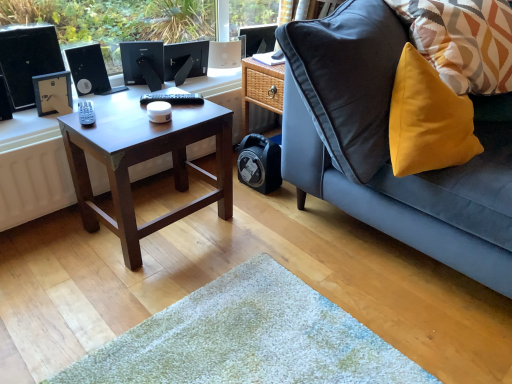
Question: Considering the relative positions of dark brown wood coffee table at center and satin black monitor at center, which is the 3th computer monitor in right-to-left order, in the image provided, is dark brown wood coffee table at center to the left of satin black monitor at center, which is the 3th computer monitor in right-to-left order, from the viewer's perspective?

Choices:
 (A) no
 (B) yes

Answer: (A)

Question: Is dark brown wood coffee table at center at the right side of satin black monitor at center, which is the 3th computer monitor in right-to-left order?

Choices:
 (A) yes
 (B) no

Answer: (A)

Question: Is dark brown wood coffee table at center taller than satin black monitor at center, the first computer monitor from the left?

Choices:
 (A) no
 (B) yes

Answer: (B)

Question: Can you confirm if dark brown wood coffee table at center is thinner than satin black monitor at center, the first computer monitor from the left?

Choices:
 (A) no
 (B) yes

Answer: (A)

Question: Does dark brown wood coffee table at center have a lesser height compared to satin black monitor at center, which is the 3th computer monitor in right-to-left order?

Choices:
 (A) yes
 (B) no

Answer: (B)

Question: Does point (320, 158) appear closer or farther from the camera than point (134, 82)?

Choices:
 (A) farther
 (B) closer

Answer: (B)

Question: From a real-world perspective, is mustard yellow fabric pillow at right above or below satin black monitor at center, the first computer monitor from the left?

Choices:
 (A) below
 (B) above

Answer: (B)

Question: From the image's perspective, is mustard yellow fabric pillow at right located above or below satin black monitor at center, which is the 3th computer monitor in right-to-left order?

Choices:
 (A) above
 (B) below

Answer: (B)

Question: In the image, is mustard yellow fabric pillow at right positioned in front of or behind satin black monitor at center, which is the 3th computer monitor in right-to-left order?

Choices:
 (A) front
 (B) behind

Answer: (A)

Question: From a real-world perspective, is satin black monitor at center, which is the 3th computer monitor in right-to-left order, above or below black matte desktop computer at left?

Choices:
 (A) below
 (B) above

Answer: (A)

Question: Looking at the image, does satin black monitor at center, which is the 3th computer monitor in right-to-left order, seem bigger or smaller compared to black matte desktop computer at left?

Choices:
 (A) small
 (B) big

Answer: (A)

Question: Is satin black monitor at center, which is the 3th computer monitor in right-to-left order, inside or outside of black matte desktop computer at left?

Choices:
 (A) inside
 (B) outside

Answer: (B)

Question: Is satin black monitor at center, the first computer monitor from the left, wider or thinner than black matte desktop computer at left?

Choices:
 (A) thin
 (B) wide

Answer: (B)

Question: Based on their sizes in the image, would you say satin black monitor at upper center, which ranks as the second computer monitor in right-to-left order, is bigger or smaller than black matte desktop computer at left?

Choices:
 (A) big
 (B) small

Answer: (B)

Question: In terms of width, does satin black monitor at upper center, which ranks as the second computer monitor in right-to-left order, look wider or thinner when compared to black matte desktop computer at left?

Choices:
 (A) thin
 (B) wide

Answer: (A)